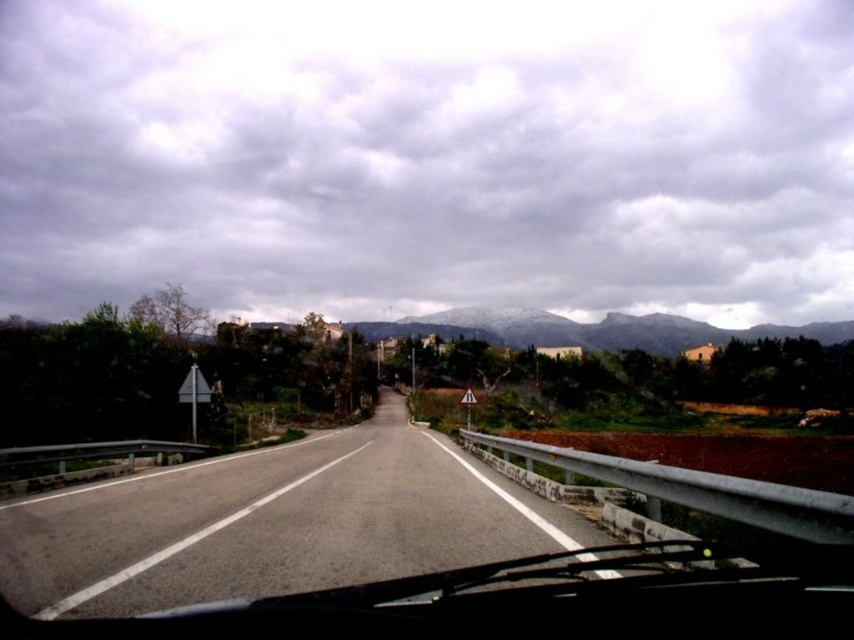
Question: Among these points, which one is nearest to the camera?

Choices:
 (A) (583, 532)
 (B) (26, 218)

Answer: (A)

Question: Where is cloudy sky at upper center located in relation to asphalt road at center in the image?

Choices:
 (A) left
 (B) right

Answer: (B)

Question: Which object appears farthest from the camera in this image?

Choices:
 (A) cloudy sky at upper center
 (B) snow-covered rock formation at center
 (C) asphalt road at center

Answer: (A)

Question: Estimate the real-world distances between objects in this image. Which object is closer to the snow-covered rock formation at center?

Choices:
 (A) cloudy sky at upper center
 (B) asphalt road at center

Answer: (A)

Question: Is cloudy sky at upper center above snow-covered rock formation at center?

Choices:
 (A) no
 (B) yes

Answer: (B)

Question: Does cloudy sky at upper center have a greater width compared to asphalt road at center?

Choices:
 (A) no
 (B) yes

Answer: (B)